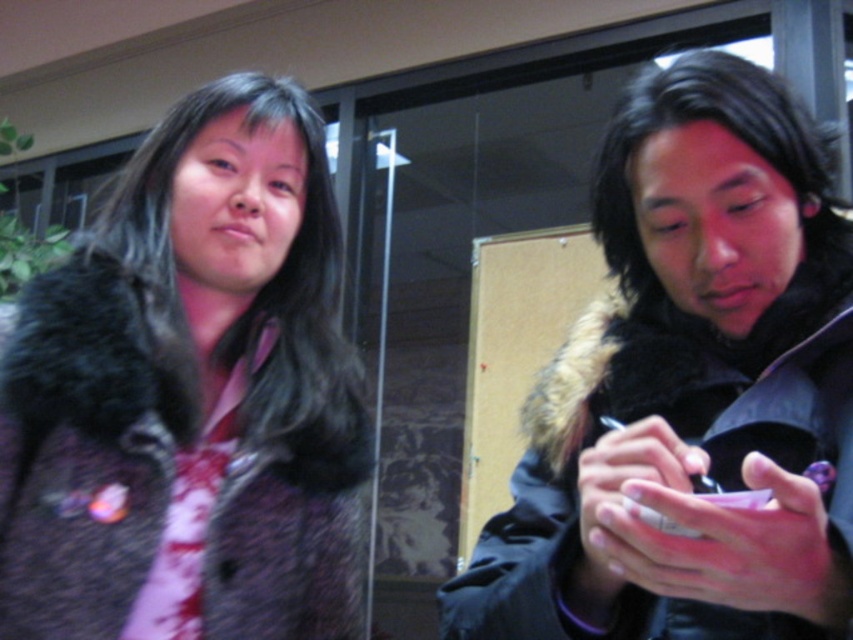
Is fuzzy fur coat at left positioned behind black fur coat at right?

Yes, fuzzy fur coat at left is behind black fur coat at right.

Is fuzzy fur coat at left thinner than black fur coat at right?

Indeed, fuzzy fur coat at left has a lesser width compared to black fur coat at right.

Is point (281, 541) in front of point (751, 548)?

No, it is not.

Where is `fuzzy fur coat at left`? Image resolution: width=853 pixels, height=640 pixels. fuzzy fur coat at left is located at coordinates (190, 396).